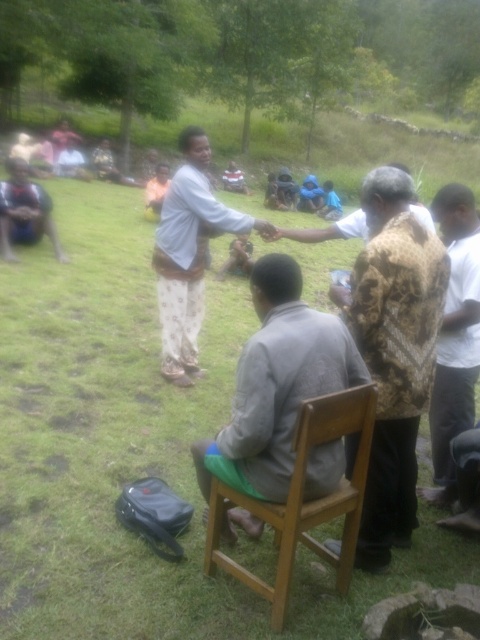
Who is taller, patterned fabric shawl at center or dark blue shirt at lower left?

With more height is patterned fabric shawl at center.

Describe the element at coordinates (394, 353) in the screenshot. I see `patterned fabric shawl at center` at that location.

What do you see at coordinates (394, 353) in the screenshot? Image resolution: width=480 pixels, height=640 pixels. I see `patterned fabric shawl at center` at bounding box center [394, 353].

At what (x,y) coordinates should I click in order to perform the action: click on patterned fabric shawl at center. Please return your answer as a coordinate pair (x, y). Looking at the image, I should click on (394, 353).

Is point (184, 285) farther from camera compared to point (468, 234)?

Yes, it is.

Does point (171, 236) lie behind point (454, 492)?

That is True.

Where is `light gray shirt at center`? The image size is (480, 640). light gray shirt at center is located at coordinates (189, 253).

Who is more distant from viewer, (155, 346) or (178, 212)?

Positioned behind is point (155, 346).

Does green grass at center have a lesser width compared to light gray shirt at center?

No, green grass at center is not thinner than light gray shirt at center.

The image size is (480, 640). What do you see at coordinates (135, 451) in the screenshot? I see `green grass at center` at bounding box center [135, 451].

Locate an element on the screen. This screenshot has width=480, height=640. green grass at center is located at coordinates (135, 451).